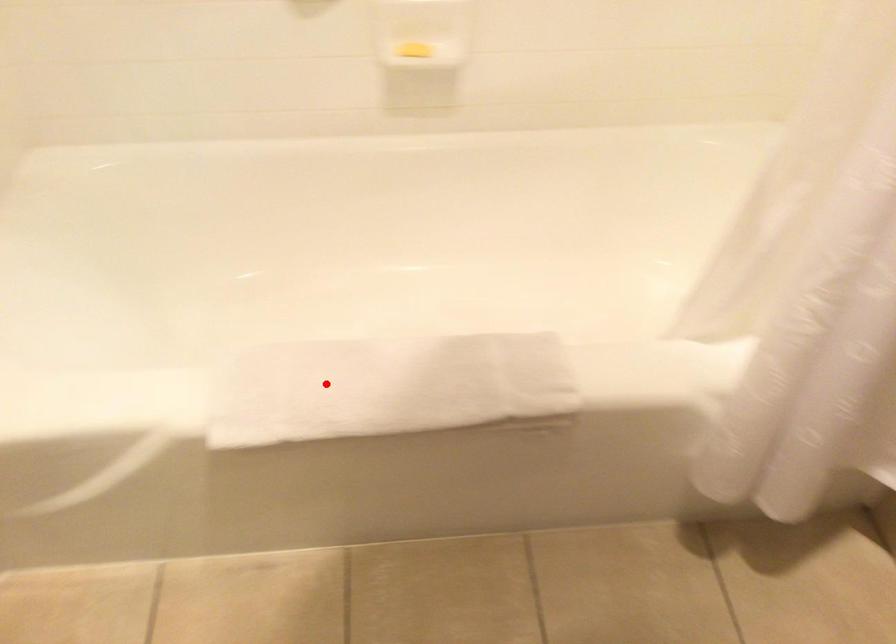
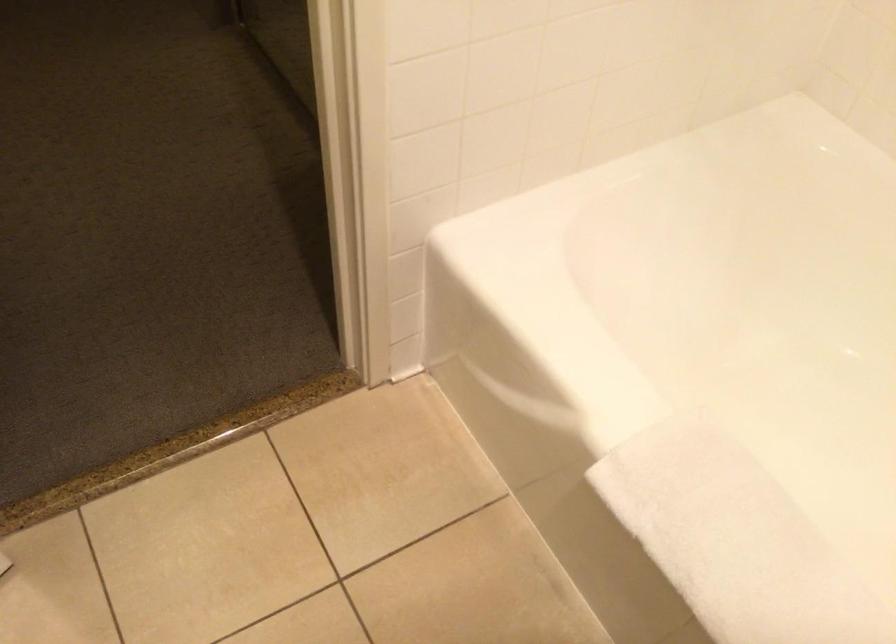
Question: A red point is marked in image1. In image2, is the corresponding 3D point closer to the camera or farther? Reply with the corresponding letter.

Choices:
 (A) The corresponding 3D point is closer.
 (B) The corresponding 3D point is farther.

Answer: (A)